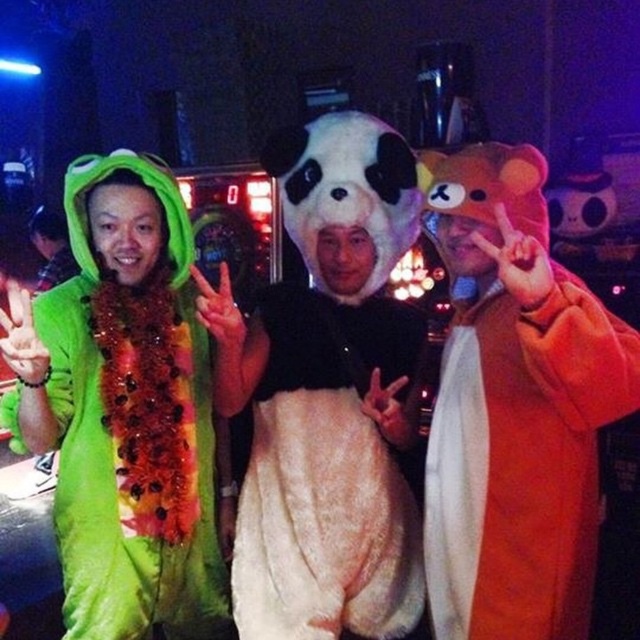
Is orange plush bear at center positioned at the back of green fuzzy frog at left?

No, it is in front of green fuzzy frog at left.

Between point (492, 422) and point (148, 230), which one is positioned in front?

Point (492, 422)

Image resolution: width=640 pixels, height=640 pixels. In order to click on orange plush bear at center in this screenshot , I will do coord(515,406).

Can you confirm if orange plush bear at center is wider than fuzzy white dress at center?

No.

Who is shorter, orange plush bear at center or fuzzy white dress at center?

With less height is fuzzy white dress at center.

Describe the element at coordinates (515, 406) in the screenshot. I see `orange plush bear at center` at that location.

Locate an element on the screen. orange plush bear at center is located at coordinates (515, 406).

Looking at this image, is green fuzzy frog at left to the left of fuzzy white dress at center from the viewer's perspective?

Indeed, green fuzzy frog at left is positioned on the left side of fuzzy white dress at center.

Can you confirm if green fuzzy frog at left is taller than fuzzy white dress at center?

Yes.

Identify the location of green fuzzy frog at left. (124, 410).